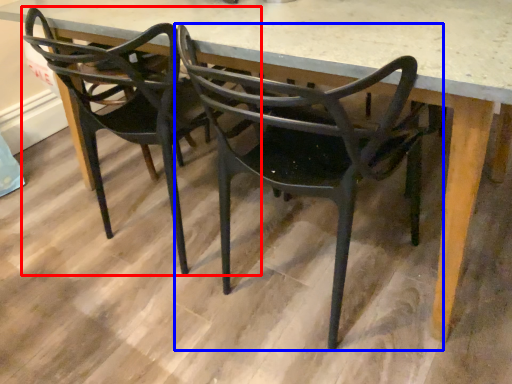
Question: Which point is closer to the camera, chair (highlighted by a red box) or chair (highlighted by a blue box)?

Choices:
 (A) chair
 (B) chair

Answer: (B)